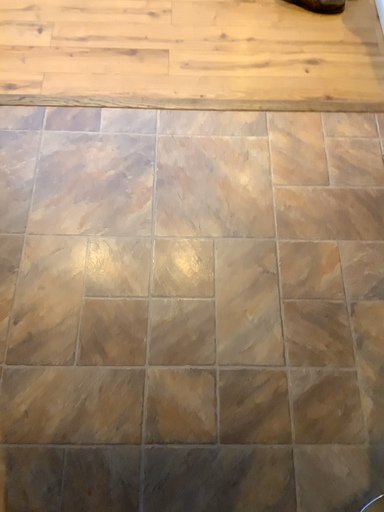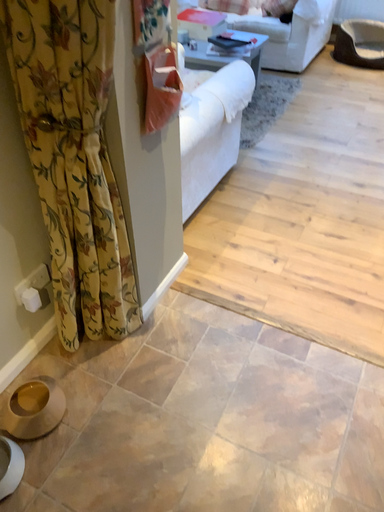
Question: How did the camera likely rotate when shooting the video?

Choices:
 (A) rotated right
 (B) rotated left

Answer: (B)